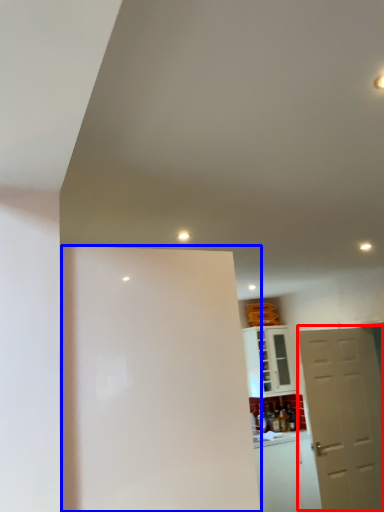
Question: Which object is further to the camera taking this photo, door (highlighted by a red box) or screen door (highlighted by a blue box)?

Choices:
 (A) door
 (B) screen door

Answer: (A)